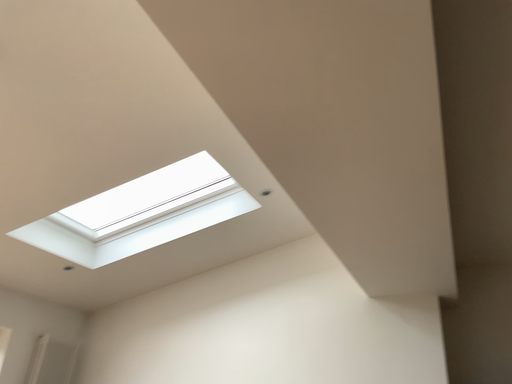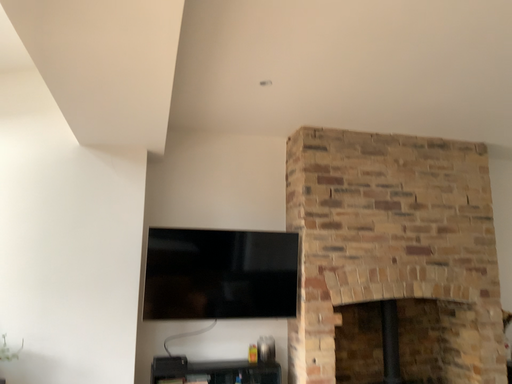
Question: How did the camera likely rotate when shooting the video?

Choices:
 (A) rotated upward
 (B) rotated downward

Answer: (B)